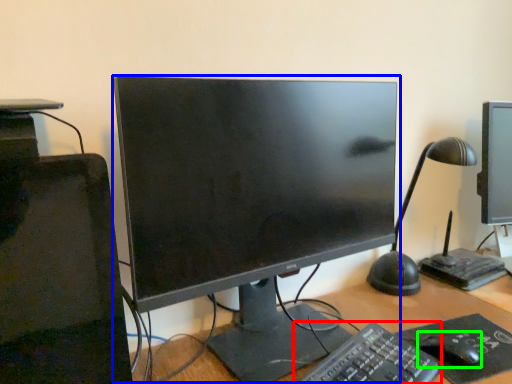
Question: Based on their relative distances, which object is nearer to computer keyboard (highlighted by a red box)? Choose from computer monitor (highlighted by a blue box) and mouse (highlighted by a green box).

Choices:
 (A) computer monitor
 (B) mouse

Answer: (B)